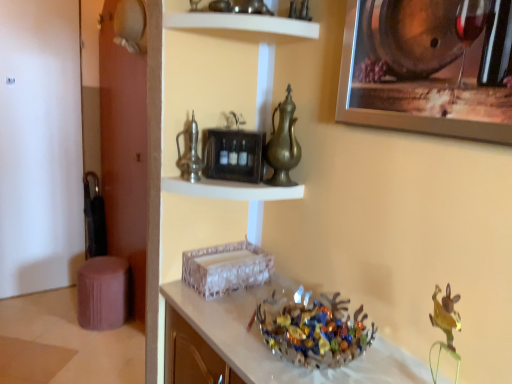
In order to click on free point above translucent glass bowl at center (from a real-world perspective) in this screenshot , I will do `click(272, 354)`.